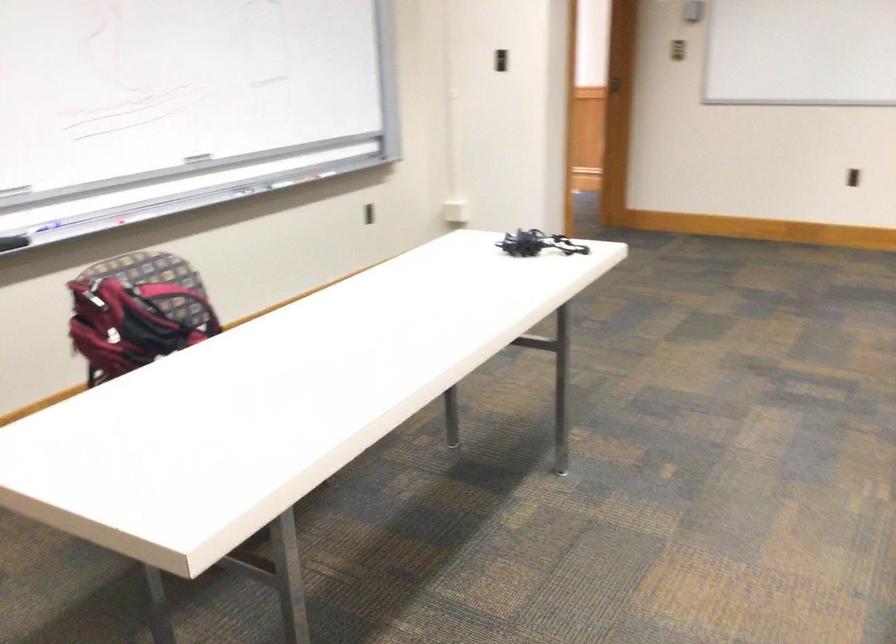
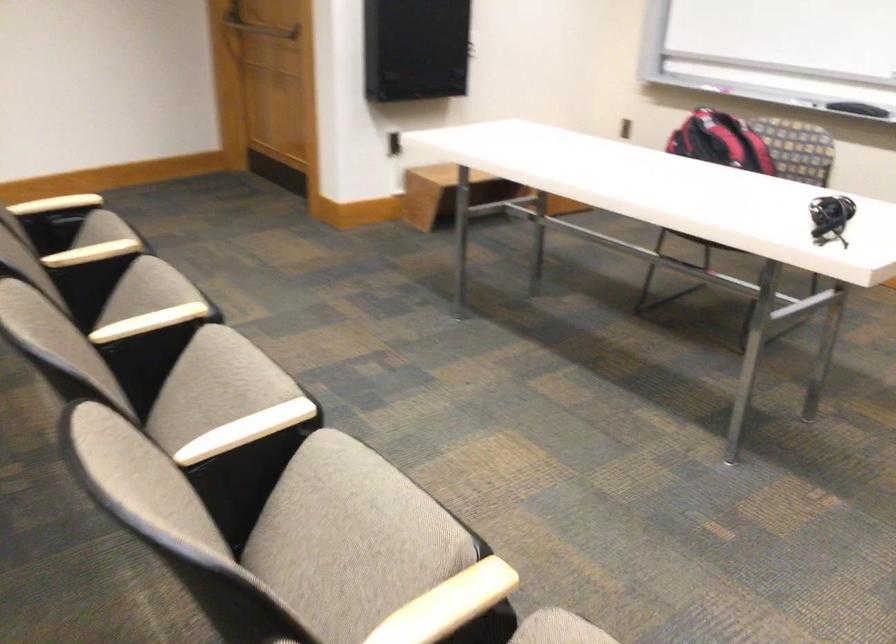
The point at (x=527, y=234) is marked in the first image. Where is the corresponding point in the second image?

(830, 218)